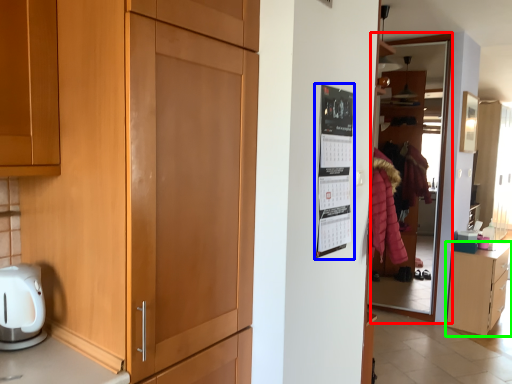
Question: Which is farther away from glass door (highlighted by a red box)? bulletin board (highlighted by a blue box) or cabinetry (highlighted by a green box)?

Choices:
 (A) bulletin board
 (B) cabinetry

Answer: (A)